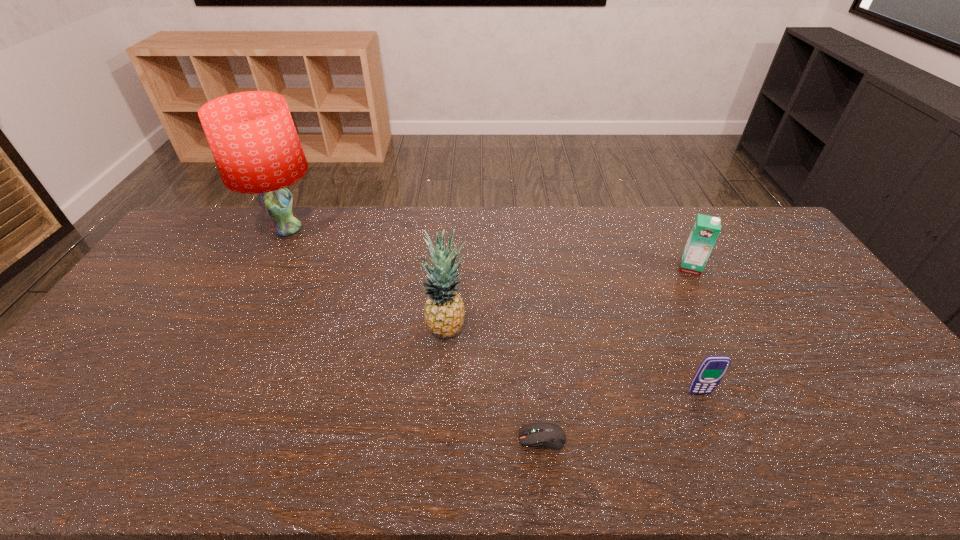
You are a GUI agent. You are given a task and a screenshot of the screen. Output one action in this format:
    pyautogui.click(x=<x>, y=<y>)
    Task: Click on the free region located 0.280m on the front-facing side of the farthest object
    
    Given the screenshot: What is the action you would take?
    pos(243,313)

I want to click on free space located on the left of the pineapple, so click(x=385, y=328).

Where is `vacant region located on the front of the carton`? vacant region located on the front of the carton is located at coordinates (749, 381).

At what (x,y) coordinates should I click in order to perform the action: click on free space located on the front-facing side of the second nearest object. Please return your answer as a coordinate pair (x, y). Looking at the image, I should click on (722, 449).

This screenshot has width=960, height=540. What are the coordinates of `free location located 0.360m on the button of the computer equipment` in the screenshot? It's located at (365, 438).

Locate an element on the screen. Image resolution: width=960 pixels, height=540 pixels. free spot located on the button of the computer equipment is located at coordinates pos(429,438).

Where is `vacant space situated on the button of the computer equipment`? This screenshot has width=960, height=540. vacant space situated on the button of the computer equipment is located at coordinates (377, 438).

Locate an element on the screen. The image size is (960, 540). object present at the far edge is located at coordinates (252, 136).

You are a GUI agent. You are given a task and a screenshot of the screen. Output one action in this format:
    pyautogui.click(x=<x>, y=<y>)
    Task: Click on the object situated at the near edge
    
    Given the screenshot: What is the action you would take?
    [546, 435]

The height and width of the screenshot is (540, 960). In the image, there is a desktop. Find the location of `vacant space at the far edge`. vacant space at the far edge is located at coordinates (537, 222).